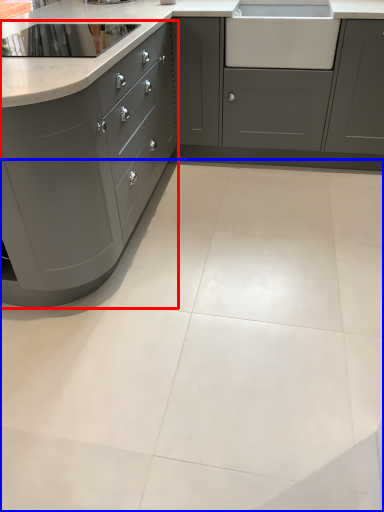
Question: Which of the following is the closest to the observer, cabinetry (highlighted by a red box) or ceramic tile (highlighted by a blue box)?

Choices:
 (A) cabinetry
 (B) ceramic tile

Answer: (B)